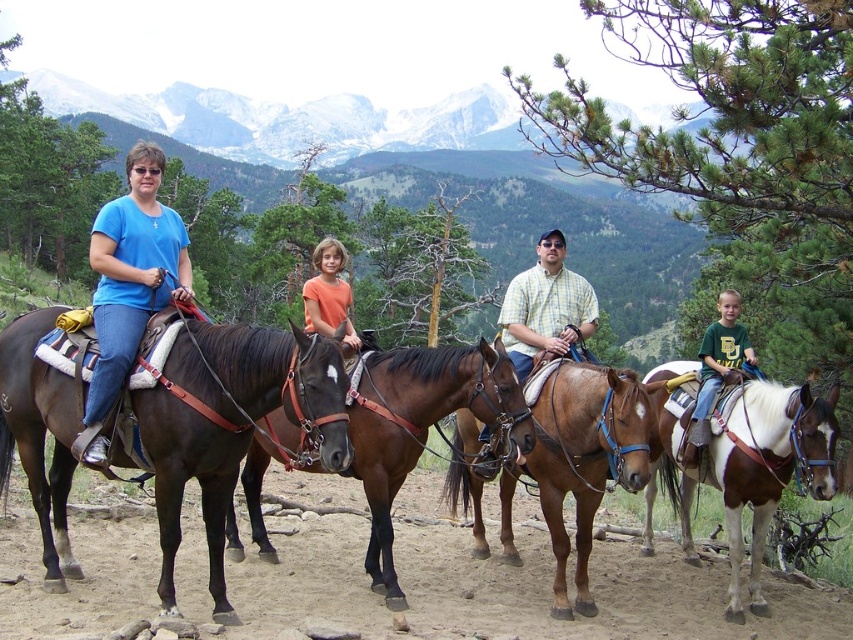
You are a photographer standing in front of the group of riders. You want to take a photo focusing on the brown leather horse at center and the orange matte shirt at center. Which object should you adjust your camera focus on first if you want to capture both clearly?

The brown leather horse at center is closer to you than the orange matte shirt at center, so you should focus on the brown leather horse at center first to ensure both are in focus.

You are a photographer trying to capture a group photo of the riders. You want to ensure that both the shiny brown horse at left and the green cotton shirt at center are clearly visible in the frame. Given their sizes, which object should you focus on first to ensure proper focus?

The shiny brown horse at left is larger than the green cotton shirt at center, so you should focus on the shiny brown horse at left first to ensure proper focus.